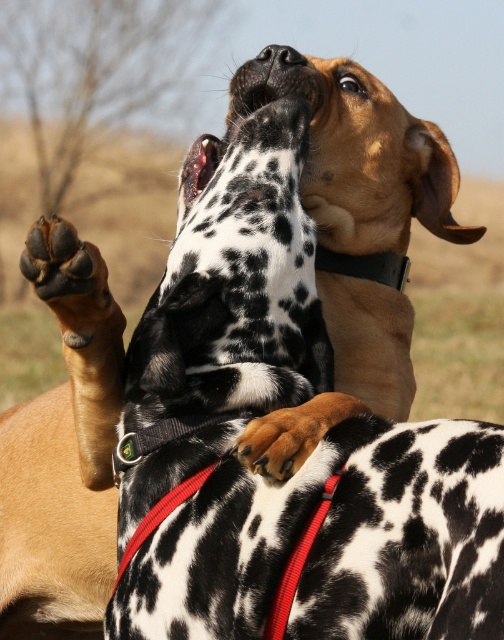
Does brown fur paw at center appear under black rubber collar at upper center?

Correct, brown fur paw at center is located below black rubber collar at upper center.

Is point (277, 465) closer to camera compared to point (386, 284)?

Yes, point (277, 465) is closer to viewer.

Find the location of a particular element. The image size is (504, 640). brown fur paw at center is located at coordinates (292, 433).

Does point (320, 257) come closer to viewer compared to point (292, 49)?

No, it is not.

Does point (345, 259) come behind point (268, 48)?

Yes, point (345, 259) is farther from viewer.

Which is behind, point (386, 272) or point (289, 65)?

The point (386, 272) is behind.

Locate an element on the screen. Image resolution: width=504 pixels, height=640 pixels. black rubber collar at upper center is located at coordinates (365, 266).

Is brown fur paw at center thinner than black smooth nose at upper center?

No, brown fur paw at center is not thinner than black smooth nose at upper center.

Find the location of a particular element. This screenshot has height=640, width=504. brown fur paw at center is located at coordinates (292, 433).

Locate an element on the screen. brown fur paw at center is located at coordinates (292, 433).